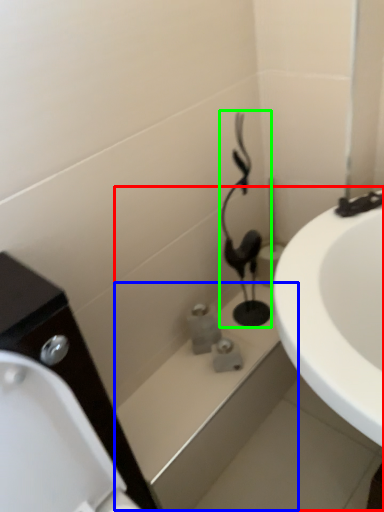
Question: Considering the real-world distances, which object is closest to bath (highlighted by a red box)? bath (highlighted by a blue box) or plumbing fixture (highlighted by a green box).

Choices:
 (A) bath
 (B) plumbing fixture

Answer: (A)